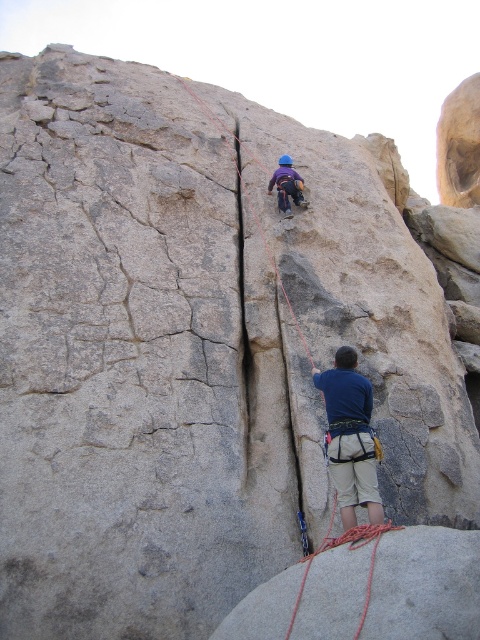
You are a safety inspector checking the climbing gear. You notice the blue fabric shirt at lower center and the matte purple helmet at upper center. Which one is bigger in size?

The blue fabric shirt at lower center has a larger size compared to the matte purple helmet at upper center.

You are a safety inspector assessing the climbing setup. You notice the blue fabric shirt at lower center and the red nylon rope at lower right. Which object occupies a smaller horizontal space in the image?

The blue fabric shirt at lower center has a lesser width compared to the red nylon rope at lower right, so it occupies a smaller horizontal space.

You are standing at the base of the cliff and see the point marked at coordinates point [370,570]. If you want to throw a rope to that point, and your maximum throwing distance is 100 feet, will you be able to reach it?

The point [370,570] is 106.66 feet away from the viewer. Since your maximum throwing distance is 100 feet, you will not be able to reach it.